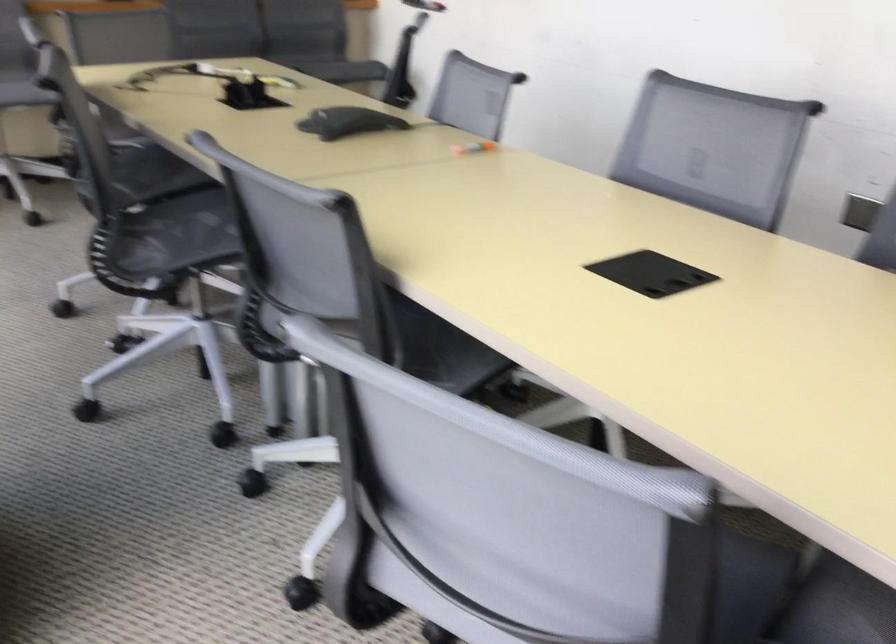
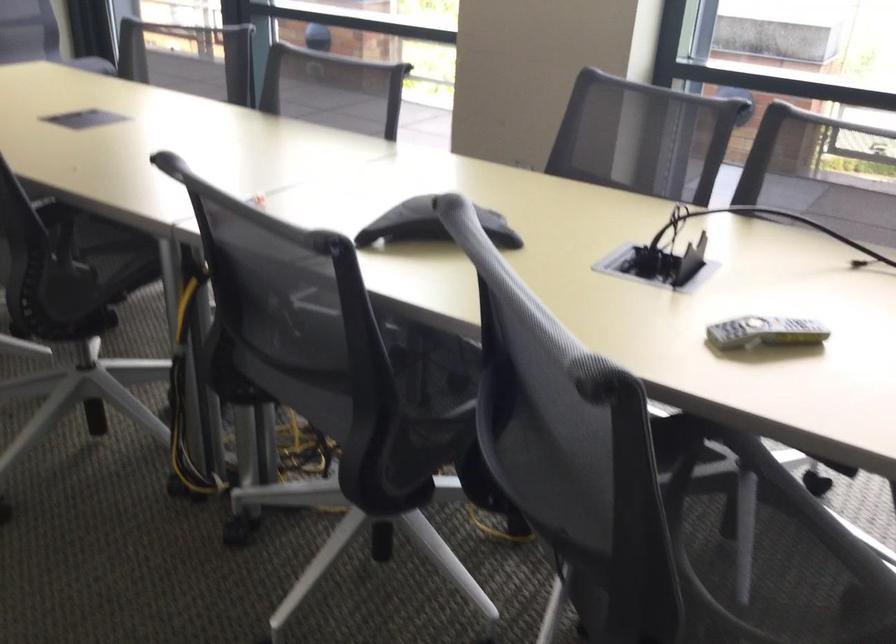
Question: I am providing you with two images of the same scene from different viewpoints. After the viewpoint changes to image2, which objects are now occluded?

Choices:
 (A) chair sitting surface
 (B) black cable cover
 (C) black conference phone
 (D) grey remote control

Answer: (A)